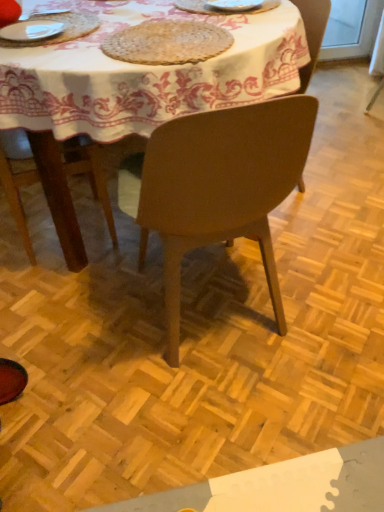
The width and height of the screenshot is (384, 512). What do you see at coordinates (167, 42) in the screenshot?
I see `woven natural fiber mat at upper center` at bounding box center [167, 42].

Image resolution: width=384 pixels, height=512 pixels. Describe the element at coordinates (195, 7) in the screenshot. I see `white ceramic plate at upper center` at that location.

Locate an element on the screen. The image size is (384, 512). matte brown chair at center, which ranks as the 1th chair in back-to-front order is located at coordinates (312, 34).

Describe the element at coordinates (312, 34) in the screenshot. The width and height of the screenshot is (384, 512). I see `matte brown chair at center, the second chair from the front` at that location.

Find the location of a particular element. The image size is (384, 512). white fabric tablecloth at center is located at coordinates (145, 73).

What is the approximate height of white fabric tablecloth at center?

The height of white fabric tablecloth at center is 31.31 inches.

Where is `woven natural fiber mat at upper center`? The width and height of the screenshot is (384, 512). woven natural fiber mat at upper center is located at coordinates (167, 42).

Based on their positions, is matte brown chair at center, marked as the first chair in a front-to-back arrangement, located to the left or right of white ceramic plate at upper center?

In the image, matte brown chair at center, marked as the first chair in a front-to-back arrangement, appears on the left side of white ceramic plate at upper center.

Can you confirm if matte brown chair at center, marked as the first chair in a front-to-back arrangement, is thinner than white ceramic plate at upper center?

Incorrect, the width of matte brown chair at center, marked as the first chair in a front-to-back arrangement, is not less than that of white ceramic plate at upper center.

In the image, is matte brown chair at center, which ranks as the 2th chair in back-to-front order, positioned in front of or behind white ceramic plate at upper center?

Visually, matte brown chair at center, which ranks as the 2th chair in back-to-front order, is located in front of white ceramic plate at upper center.

Considering the sizes of matte brown chair at center, which ranks as the 2th chair in back-to-front order, and white ceramic plate at upper center in the image, is matte brown chair at center, which ranks as the 2th chair in back-to-front order, taller or shorter than white ceramic plate at upper center?

matte brown chair at center, which ranks as the 2th chair in back-to-front order, is taller than white ceramic plate at upper center.

Would you consider matte brown chair at center, which ranks as the 1th chair in back-to-front order, to be distant from white glossy plate at upper left?

matte brown chair at center, which ranks as the 1th chair in back-to-front order, is actually quite close to white glossy plate at upper left.

From a real-world perspective, which is physically above, matte brown chair at center, which ranks as the 1th chair in back-to-front order, or white glossy plate at upper left?

From a 3D spatial view, white glossy plate at upper left is above.

Could white glossy plate at upper left be considered to be inside matte brown chair at center, which ranks as the 1th chair in back-to-front order?

No.

Does point (316, 4) appear closer or farther from the camera than point (4, 28)?

Clearly, point (316, 4) is more distant from the camera than point (4, 28).

In the image, is white ceramic plate at upper center on the left side or the right side of white glossy plate at upper left?

white ceramic plate at upper center is positioned on white glossy plate at upper left's right side.

Considering the relative sizes of white ceramic plate at upper center and white glossy plate at upper left in the image provided, is white ceramic plate at upper center smaller than white glossy plate at upper left?

Correct, white ceramic plate at upper center occupies less space than white glossy plate at upper left.

Based on the photo, from the image's perspective, which object appears higher, white ceramic plate at upper center or white glossy plate at upper left?

white ceramic plate at upper center, from the image's perspective.

Does matte brown chair at center, the second chair from the front, turn towards woven natural fiber mat at upper center?

Yes, matte brown chair at center, the second chair from the front, is facing woven natural fiber mat at upper center.

Who is smaller, matte brown chair at center, which ranks as the 1th chair in back-to-front order, or woven natural fiber mat at upper center?

Smaller between the two is woven natural fiber mat at upper center.

From a real-world perspective, between matte brown chair at center, which ranks as the 1th chair in back-to-front order, and woven natural fiber mat at upper center, who is vertically higher?

woven natural fiber mat at upper center.

Would you say white ceramic plate at upper center is to the left or to the right of matte brown chair at center, which ranks as the 2th chair in back-to-front order, in the picture?

In the image, white ceramic plate at upper center appears on the right side of matte brown chair at center, which ranks as the 2th chair in back-to-front order.

From a real-world perspective, starting from the white ceramic plate at upper center, which chair is the 2nd one below it? Please provide its 2D coordinates.

[(221, 187)]

Based on their sizes in the image, would you say white ceramic plate at upper center is bigger or smaller than matte brown chair at center, which ranks as the 2th chair in back-to-front order?

Clearly, white ceramic plate at upper center is smaller in size than matte brown chair at center, which ranks as the 2th chair in back-to-front order.

In terms of height, does white ceramic plate at upper center look taller or shorter compared to matte brown chair at center, which ranks as the 2th chair in back-to-front order?

In the image, white ceramic plate at upper center appears to be shorter than matte brown chair at center, which ranks as the 2th chair in back-to-front order.

Considering the positions of objects white glossy plate at upper left and white ceramic plate at upper center in the image provided, who is behind, white glossy plate at upper left or white ceramic plate at upper center?

white ceramic plate at upper center is more distant.

From a real-world perspective, between white glossy plate at upper left and white ceramic plate at upper center, who is vertically higher?

In real-world perspective, white ceramic plate at upper center is above.

From the image's perspective, is white glossy plate at upper left located above or below white ceramic plate at upper center?

white glossy plate at upper left is situated lower than white ceramic plate at upper center in the image.

Is white glossy plate at upper left positioned with its back to white ceramic plate at upper center?

white glossy plate at upper left does not have its back to white ceramic plate at upper center.

Based on the photo, considering the relative positions of matte brown chair at center, marked as the first chair in a front-to-back arrangement, and woven natural fiber mat at upper center in the image provided, is matte brown chair at center, marked as the first chair in a front-to-back arrangement, in front of woven natural fiber mat at upper center?

Yes, matte brown chair at center, marked as the first chair in a front-to-back arrangement, is closer to the viewer.

Measure the distance from matte brown chair at center, marked as the first chair in a front-to-back arrangement, to woven natural fiber mat at upper center.

16.35 inches.

I want to click on chair below the woven natural fiber mat at upper center (from the image's perspective), so click(x=221, y=187).

Can woven natural fiber mat at upper center be found inside matte brown chair at center, marked as the first chair in a front-to-back arrangement?

Yes, woven natural fiber mat at upper center is a part of matte brown chair at center, marked as the first chair in a front-to-back arrangement.

Image resolution: width=384 pixels, height=512 pixels. In the image, there is a matte brown chair at center, marked as the first chair in a front-to-back arrangement. What are the coordinates of `tableware above it (from the image's perspective)` in the screenshot? It's located at (195, 7).

Locate an element on the screen. This screenshot has height=512, width=384. chair that is the 2nd object to the right of the white glossy plate at upper left, starting at the anchor is located at coordinates (312, 34).

From the picture: From the image, which object appears to be nearer to matte brown chair at center, the second chair from the front, matte brown chair at center, marked as the first chair in a front-to-back arrangement, or white fabric tablecloth at center?

white fabric tablecloth at center is positioned closer to the anchor matte brown chair at center, the second chair from the front.

Based on their spatial positions, is woven natural fiber mat at upper center or white fabric tablecloth at center further from matte brown chair at center, marked as the first chair in a front-to-back arrangement?

woven natural fiber mat at upper center is further to matte brown chair at center, marked as the first chair in a front-to-back arrangement.

Considering their positions, is woven natural fiber mat at upper center positioned closer to matte brown chair at center, the second chair from the front, than white ceramic plate at upper center?

white ceramic plate at upper center is positioned closer to the anchor matte brown chair at center, the second chair from the front.

From the image, which object appears to be nearer to white fabric tablecloth at center, white ceramic plate at upper center or matte brown chair at center, which ranks as the 1th chair in back-to-front order?

white ceramic plate at upper center lies closer to white fabric tablecloth at center than the other object.

In the scene shown: Considering their positions, is white fabric tablecloth at center positioned closer to woven natural fiber mat at upper center than white ceramic plate at upper center?

Among the two, white fabric tablecloth at center is located nearer to woven natural fiber mat at upper center.

Estimate the real-world distances between objects in this image. Which object is closer to white fabric tablecloth at center, woven natural fiber mat at upper center or white glossy plate at upper left?

woven natural fiber mat at upper center.

Which object lies further to the anchor point white fabric tablecloth at center, matte brown chair at center, which ranks as the 1th chair in back-to-front order, or white glossy plate at upper left?

matte brown chair at center, which ranks as the 1th chair in back-to-front order.

Which object lies further to the anchor point matte brown chair at center, which ranks as the 2th chair in back-to-front order, woven natural fiber mat at upper center or matte brown chair at center, the second chair from the front?

Among the two, matte brown chair at center, the second chair from the front, is located further to matte brown chair at center, which ranks as the 2th chair in back-to-front order.

You are a GUI agent. You are given a task and a screenshot of the screen. Output one action in this format:
    pyautogui.click(x=<x>, y=<y>)
    Task: Click on the kitchen & dining room table located between white glossy plate at upper left and matte brown chair at center, the second chair from the front, in the left-right direction
    The image size is (384, 512).
    Given the screenshot: What is the action you would take?
    pyautogui.click(x=145, y=73)

You are a GUI agent. You are given a task and a screenshot of the screen. Output one action in this format:
    pyautogui.click(x=<x>, y=<y>)
    Task: Click on the mat between white fabric tablecloth at center and white ceramic plate at upper center from front to back
    This screenshot has height=512, width=384.
    Given the screenshot: What is the action you would take?
    pyautogui.click(x=167, y=42)

Locate an element on the screen. This screenshot has height=512, width=384. mat between white glossy plate at upper left and matte brown chair at center, which ranks as the 1th chair in back-to-front order is located at coordinates (167, 42).

You are a GUI agent. You are given a task and a screenshot of the screen. Output one action in this format:
    pyautogui.click(x=<x>, y=<y>)
    Task: Click on the plate between white ceramic plate at upper center and matte brown chair at center, which ranks as the 2th chair in back-to-front order, in the up-down direction
    
    Given the screenshot: What is the action you would take?
    (x=31, y=30)